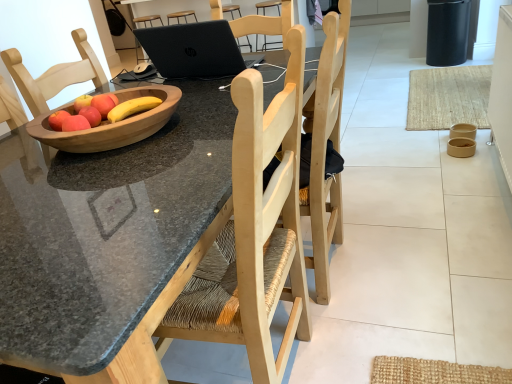
Question: Does brown paper bowl at lower right, which ranks as the second bowl in right-to-left order, come behind matte brown bowl at right, the third bowl from the front?

Choices:
 (A) no
 (B) yes

Answer: (A)

Question: Is brown paper bowl at lower right, which ranks as the 2th bowl in back-to-front order, not near matte brown bowl at right, which is counted as the third bowl, starting from the left?

Choices:
 (A) no
 (B) yes

Answer: (A)

Question: Can you confirm if brown paper bowl at lower right, which ranks as the 2th bowl in back-to-front order, is thinner than matte brown bowl at right, which is counted as the third bowl, starting from the left?

Choices:
 (A) yes
 (B) no

Answer: (B)

Question: Is brown paper bowl at lower right, which is the second bowl from front to back, wider than matte brown bowl at right, which ranks as the 1th bowl in back-to-front order?

Choices:
 (A) yes
 (B) no

Answer: (A)

Question: Is brown paper bowl at lower right, which is the second bowl from left to right, bigger than matte brown bowl at right, the 1th bowl viewed from the right?

Choices:
 (A) yes
 (B) no

Answer: (A)

Question: Does point (189, 51) appear closer or farther from the camera than point (72, 127)?

Choices:
 (A) closer
 (B) farther

Answer: (B)

Question: From a real-world perspective, is black matte laptop at upper center physically located above or below wooden bowl of fruit at center?

Choices:
 (A) above
 (B) below

Answer: (A)

Question: In the image, is black matte laptop at upper center positioned in front of or behind wooden bowl of fruit at center?

Choices:
 (A) front
 (B) behind

Answer: (B)

Question: Considering the positions of black matte laptop at upper center and wooden bowl of fruit at center in the image, is black matte laptop at upper center taller or shorter than wooden bowl of fruit at center?

Choices:
 (A) tall
 (B) short

Answer: (A)

Question: Is wooden bowl at left, which is the third bowl from right to left, in front of or behind wooden bowl of fruit at center in the image?

Choices:
 (A) behind
 (B) front

Answer: (B)

Question: Is wooden bowl at left, the 3th bowl from the back, wider or thinner than wooden bowl of fruit at center?

Choices:
 (A) wide
 (B) thin

Answer: (A)

Question: From a real-world perspective, is wooden bowl at left, which is the third bowl from right to left, positioned above or below wooden bowl of fruit at center?

Choices:
 (A) above
 (B) below

Answer: (A)

Question: Would you say wooden bowl at left, the 3th bowl from the back, is inside or outside wooden bowl of fruit at center?

Choices:
 (A) inside
 (B) outside

Answer: (B)

Question: Is matte wooden apple at center, the 2th apple from the front, bigger or smaller than black matte laptop at upper center?

Choices:
 (A) big
 (B) small

Answer: (B)

Question: Is point (104, 94) closer or farther from the camera than point (185, 64)?

Choices:
 (A) farther
 (B) closer

Answer: (B)